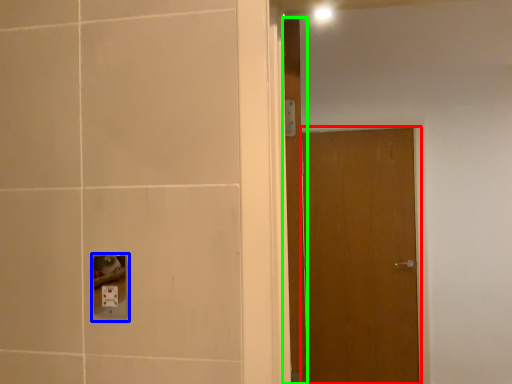
Question: Considering the real-world distances, which object is closest to door (highlighted by a red box)? socket (highlighted by a blue box) or door (highlighted by a green box).

Choices:
 (A) socket
 (B) door

Answer: (B)